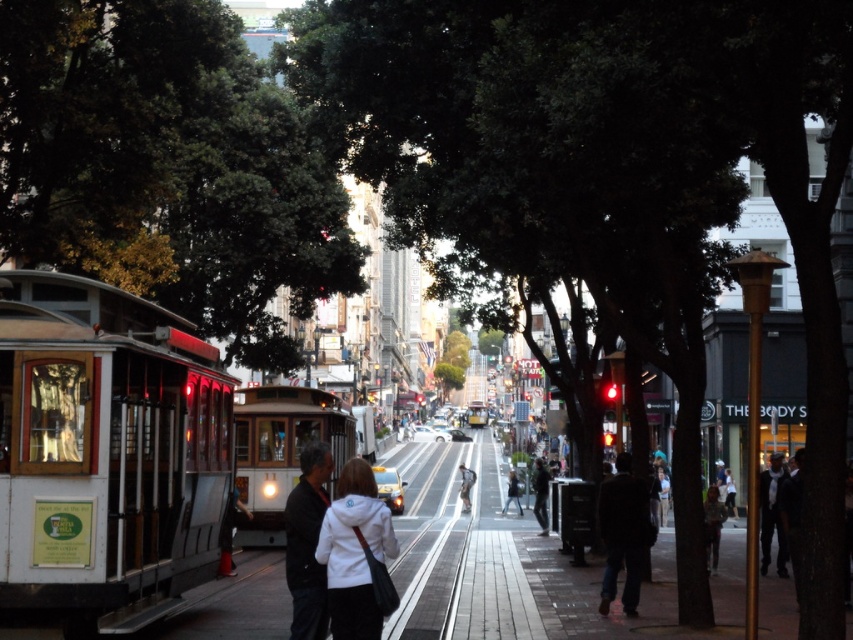
Question: Which point is closer to the camera?

Choices:
 (A) (125, 356)
 (B) (780, 545)
 (C) (633, 500)

Answer: (A)

Question: Considering the real-world distances, which object is farthest from the green leafy tree at upper left?

Choices:
 (A) dark blue jeans at lower right
 (B) polished wood cable car at left

Answer: (A)

Question: Considering the real-world distances, which object is farthest from the polished wood cable car at left?

Choices:
 (A) white fabric jacket at center
 (B) polished brass cable car at left
 (C) dark gray suit at right

Answer: (B)

Question: Is polished brass cable car at left above white cotton jacket at center?

Choices:
 (A) yes
 (B) no

Answer: (A)

Question: Is green leafy tree at center wider than dark gray suit at right?

Choices:
 (A) no
 (B) yes

Answer: (B)

Question: Considering the relative positions of polished brass cable car at left and dark blue jeans at lower right in the image provided, where is polished brass cable car at left located with respect to dark blue jeans at lower right?

Choices:
 (A) right
 (B) left

Answer: (B)